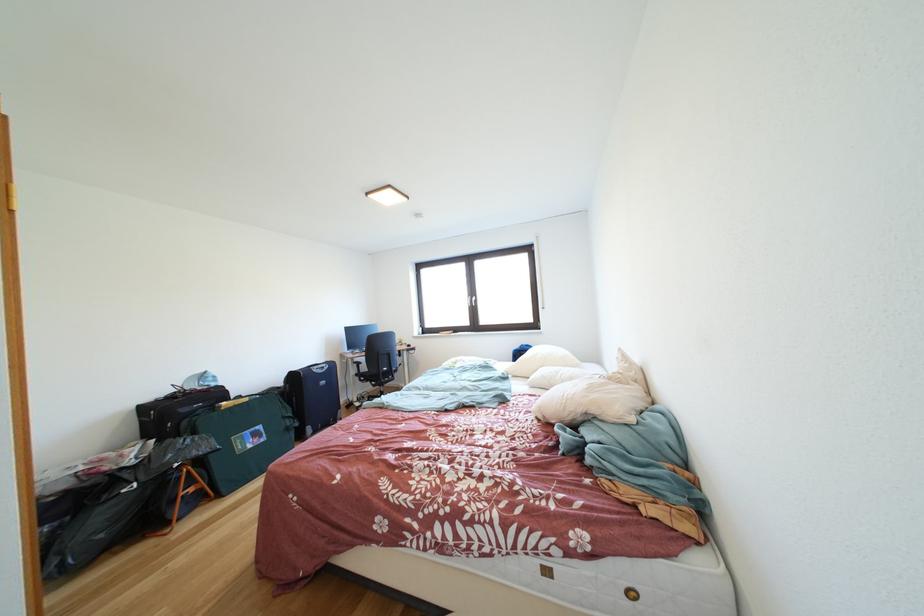
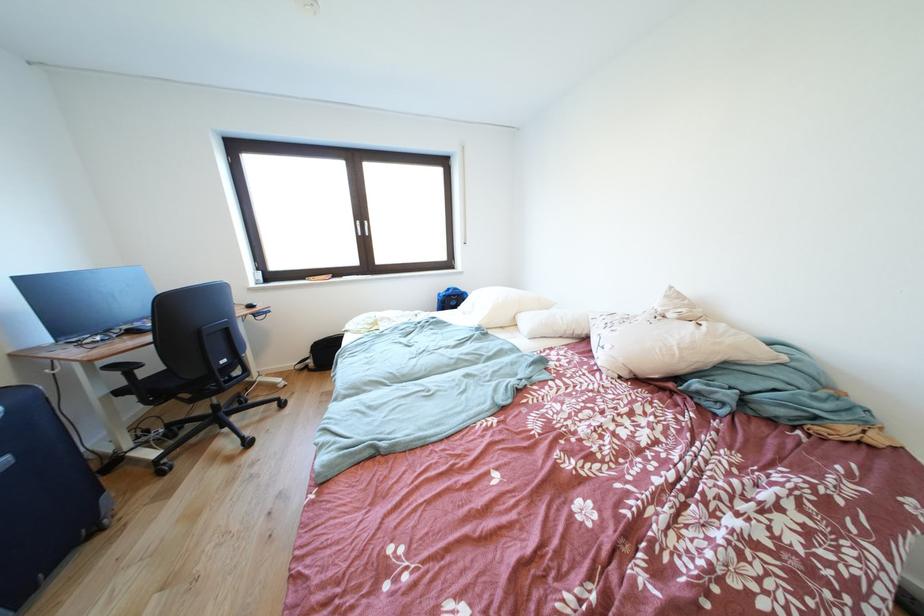
In the second image, find the point that corresponds to point 332,387 in the first image.

(8, 468)